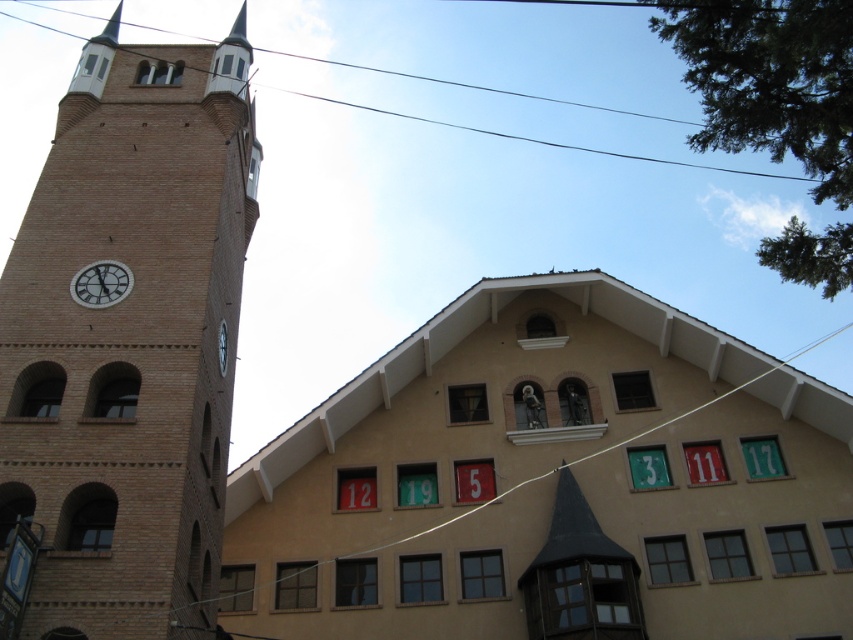
This screenshot has width=853, height=640. Describe the element at coordinates (550, 483) in the screenshot. I see `beige matte building at center` at that location.

Does beige matte building at center have a greater width compared to matte brown clock at upper left?

Yes.

Locate an element on the screen. This screenshot has width=853, height=640. beige matte building at center is located at coordinates (550, 483).

Which of these two, brick tower at left or matte brown clock at upper left, stands shorter?

matte brown clock at upper left

Identify the location of brick tower at left. (126, 346).

Does beige matte building at center have a lesser width compared to brick tower at left?

Incorrect, beige matte building at center's width is not less than brick tower at left's.

Does beige matte building at center appear over brick tower at left?

Incorrect, beige matte building at center is not positioned above brick tower at left.

Is point (538, 275) farther from camera compared to point (48, 605)?

Yes, it is.

Locate an element on the screen. The width and height of the screenshot is (853, 640). beige matte building at center is located at coordinates (550, 483).